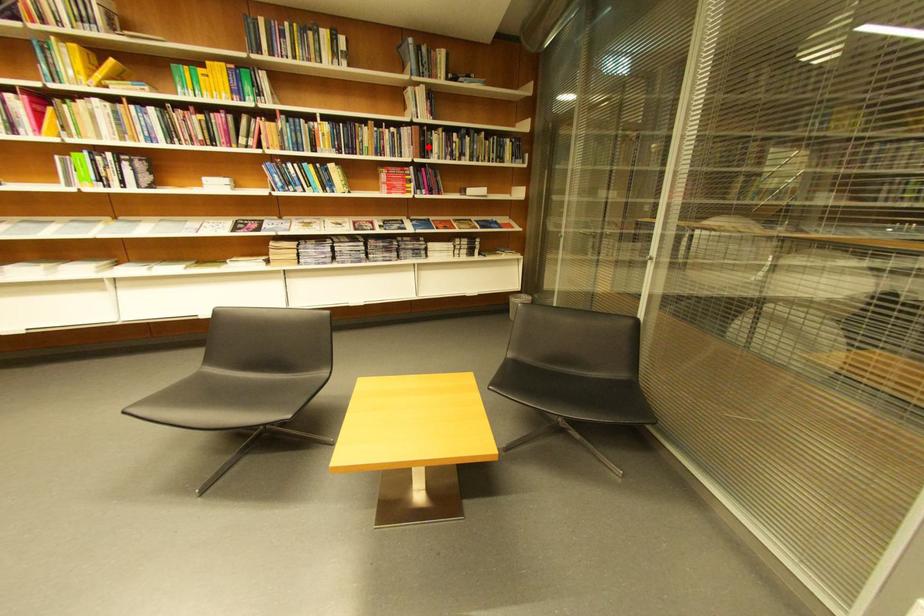
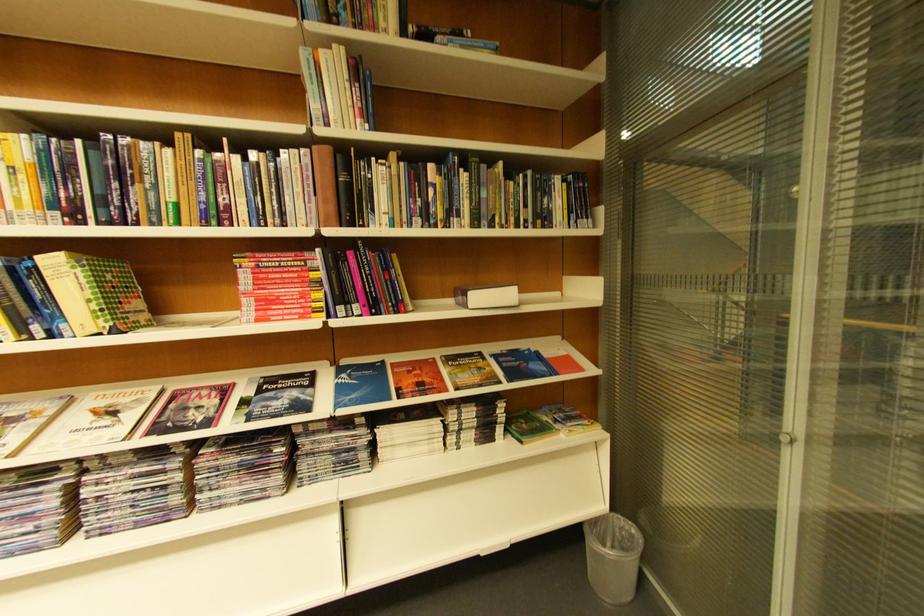
Locate, in the second image, the point that corresponds to the highlighted location in the first image.

(342, 196)